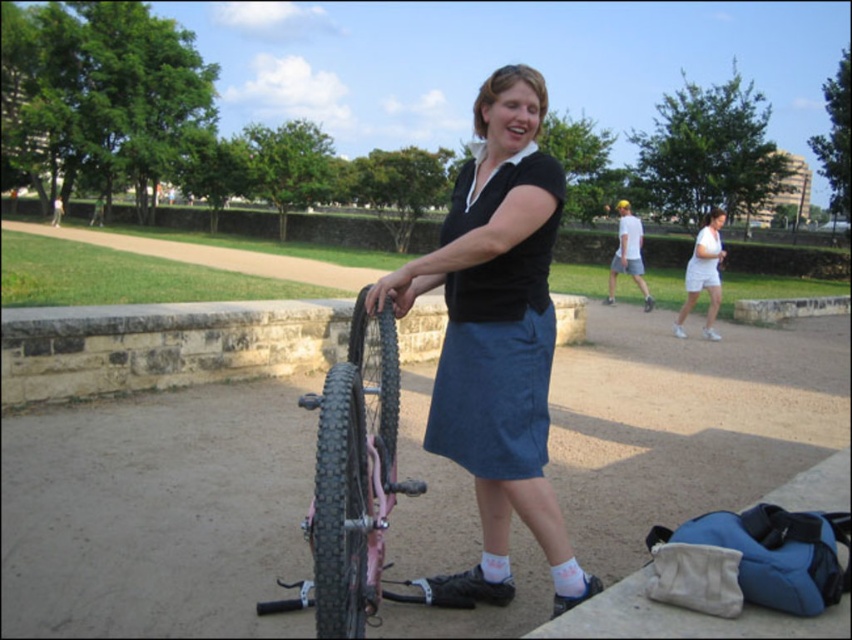
Based on the photo, you are a photographer positioned at the park entrance and want to take a photo of the pink matte bicycle at center and the white cotton shorts at right. To ensure both subjects are in focus, which object should you place the focus on first?

The pink matte bicycle at center is in front of the white cotton shorts at right, so you should focus on the pink matte bicycle at center first to ensure both are in focus.

You are a photographer setting up a tripod in the park. You want to position it so that both the pink matte bicycle at center and the white cotton shorts at right are visible in the frame. Based on their positions, which object should be placed closer to the left side of the frame?

The pink matte bicycle at center should be placed closer to the left side of the frame since it is positioned to the left of the white cotton shorts at right in the scene.

You are standing at the point labeled as point (496, 333). What is the color of the clothing item located exactly at this point?

The blue cotton dress at center is located exactly at point (496, 333), so the color is blue.